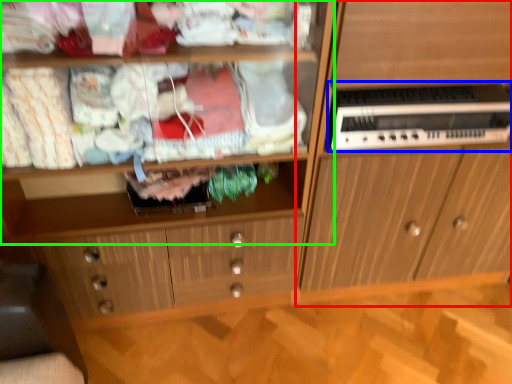
Question: Which object is the closest to the cabinetry (highlighted by a red box)? Choose among these: home appliance (highlighted by a blue box) or shelf (highlighted by a green box).

Choices:
 (A) home appliance
 (B) shelf

Answer: (A)